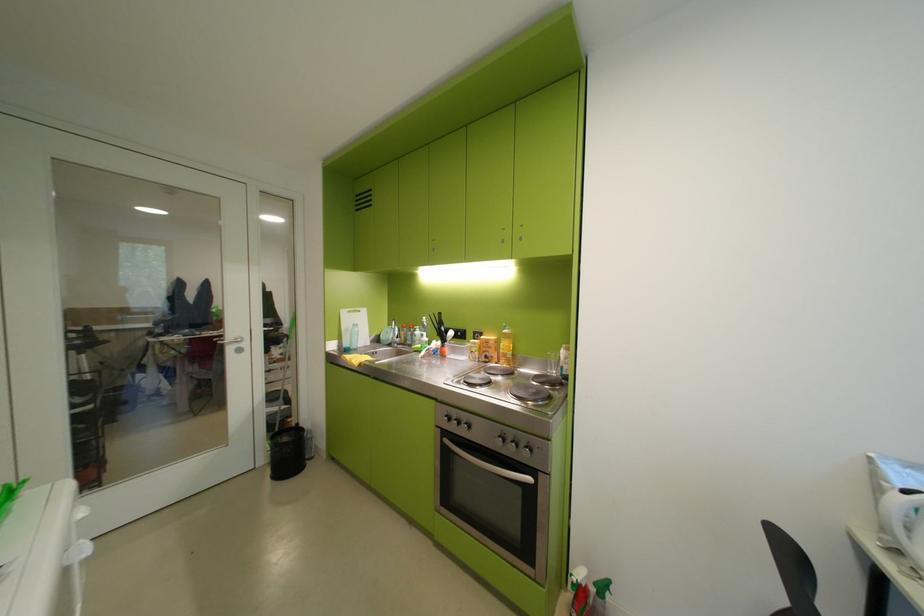
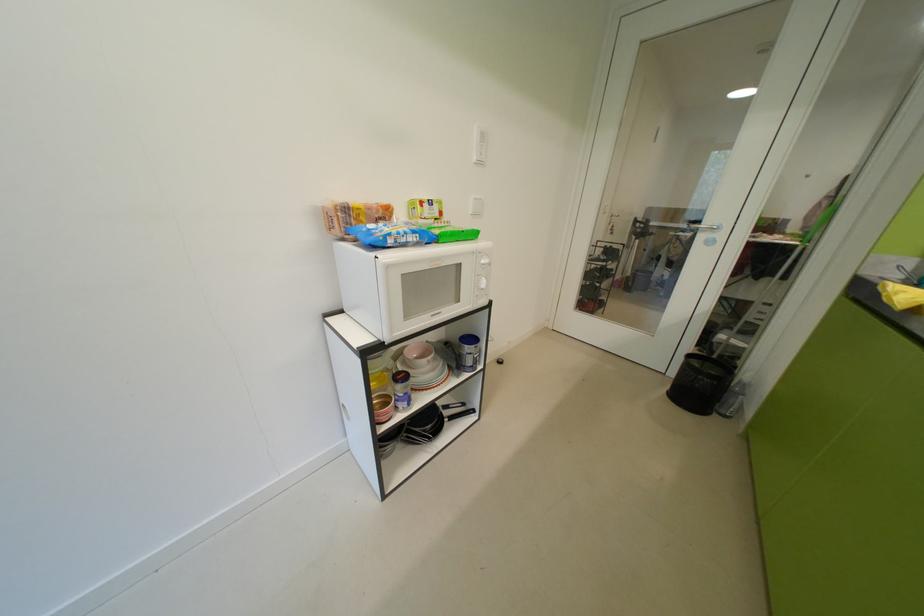
The first image is from the beginning of the video and the second image is from the end. How did the camera likely rotate when shooting the video?

The camera's rotation is toward left-down.